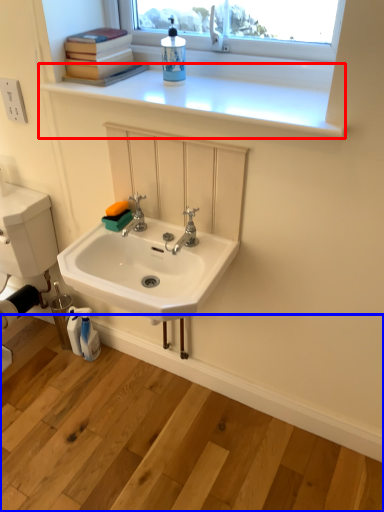
Question: Which object appears farthest to the camera in this image, window sill (highlighted by a red box) or counter (highlighted by a blue box)?

Choices:
 (A) window sill
 (B) counter

Answer: (A)